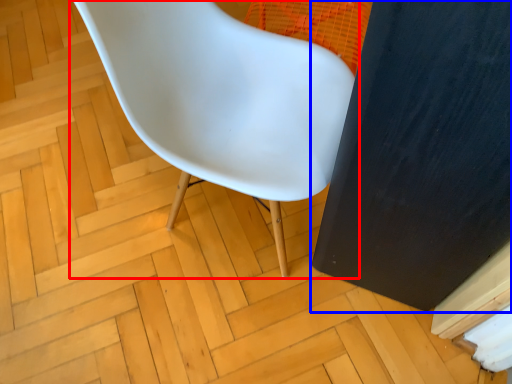
Question: Among these objects, which one is nearest to the camera, chair (highlighted by a red box) or screen door (highlighted by a blue box)?

Choices:
 (A) chair
 (B) screen door

Answer: (B)